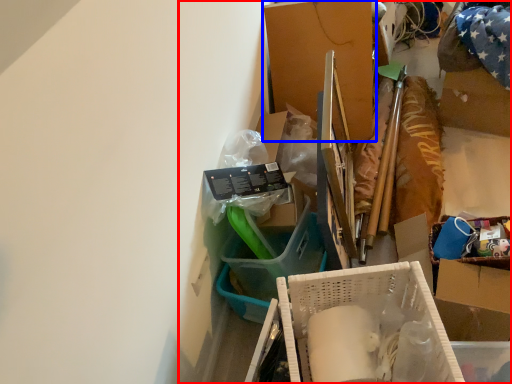
Question: Among these objects, which one is nearest to the camera, collection (highlighted by a red box) or box (highlighted by a blue box)?

Choices:
 (A) collection
 (B) box

Answer: (A)